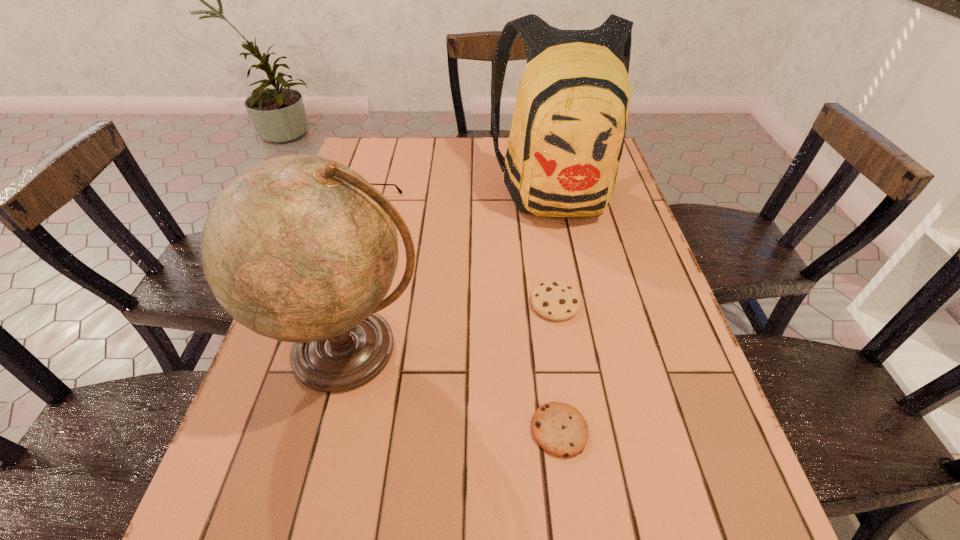
Identify the location of vacant space located 0.150m on the left of the nearer cookie. The width and height of the screenshot is (960, 540). (447, 430).

Where is `object that is at the far edge`? This screenshot has width=960, height=540. object that is at the far edge is located at coordinates (567, 134).

Where is `globe that is at the left edge`? globe that is at the left edge is located at coordinates (299, 248).

Image resolution: width=960 pixels, height=540 pixels. I want to click on spectacles that is at the left edge, so click(399, 190).

You are a GUI agent. You are given a task and a screenshot of the screen. Output one action in this format:
    pyautogui.click(x=<x>, y=<y>)
    Task: Click on the object that is at the right edge
    
    Given the screenshot: What is the action you would take?
    pyautogui.click(x=567, y=134)

You are a GUI agent. You are given a task and a screenshot of the screen. Output one action in this format:
    pyautogui.click(x=<x>, y=<y>)
    Task: Click on the object situated at the far right corner
    
    Given the screenshot: What is the action you would take?
    pyautogui.click(x=567, y=134)

Locate an element on the screen. vacant space at the far edge is located at coordinates (418, 156).

Where is `vacant space at the left edge of the desktop`? The width and height of the screenshot is (960, 540). vacant space at the left edge of the desktop is located at coordinates (274, 417).

Identify the location of vacant area at the right edge of the desktop. This screenshot has height=540, width=960. (661, 340).

In the image, there is a desktop. Identify the location of free region at the far left corner. The height and width of the screenshot is (540, 960). (392, 164).